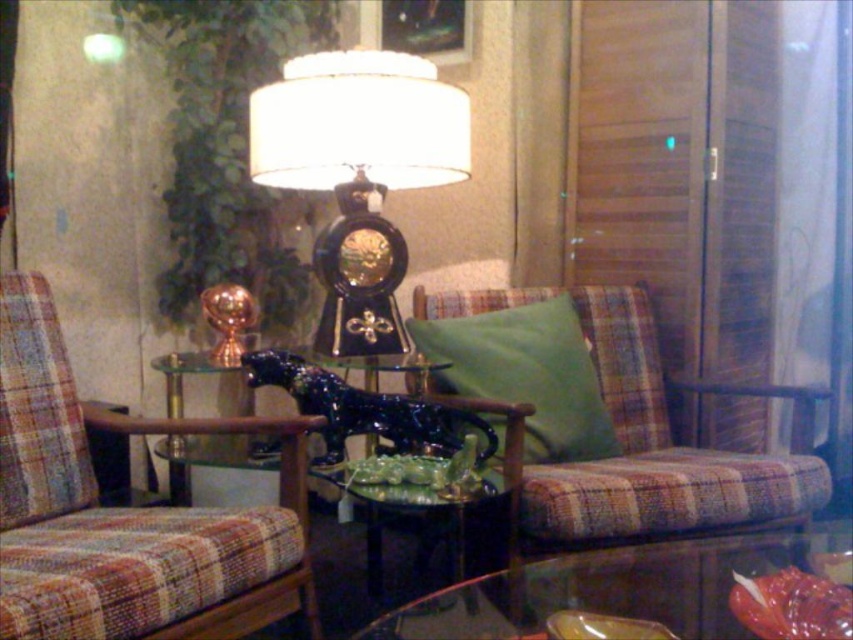
You are standing in the living room and want to place a small vase on the transparent glass table at lower center. According to the coordinates provided, is the transparent glass table at lower center located at point (614, 588)?

Yes, the transparent glass table at lower center is located at point (614, 588) as specified in the coordinates.

You are a delivery person trying to place a large package that measures 24 inches in length between the transparent glass table at lower center and the green glossy side table at center. Can the package fit in the space between them?

The distance between the transparent glass table at lower center and the green glossy side table at center is 23.77 inches. Since the package is 24 inches long, it is slightly longer than the available space, so the package cannot fit between them.

You are arranging a small vase that is 15 cm in diameter. You want to place it on the transparent glass table at lower center or the green fabric pillow at center. Which surface can it fit on?

The transparent glass table at lower center is smaller than the green fabric pillow at center. Since the vase is 15 cm in diameter, it can fit on the green fabric pillow at center, which is larger than the table.